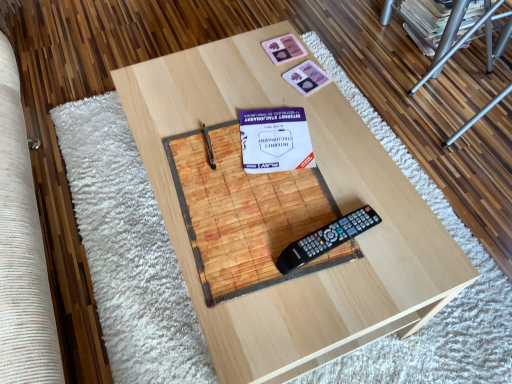
Identify the location of free location to the left of white paper at center. This screenshot has height=384, width=512. (206, 147).